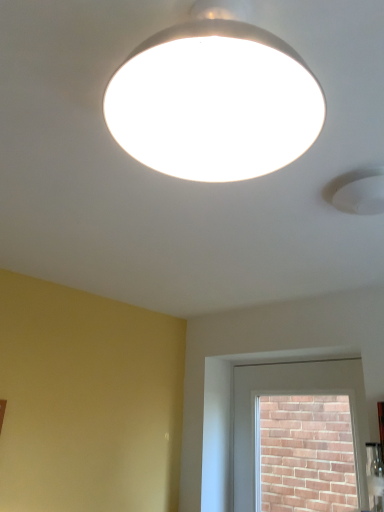
This screenshot has height=512, width=384. I want to click on brick at upper center, so (293, 394).

Image resolution: width=384 pixels, height=512 pixels. What do you see at coordinates (293, 394) in the screenshot?
I see `brick at upper center` at bounding box center [293, 394].

This screenshot has height=512, width=384. I want to click on white matte lamp at upper center, so click(x=214, y=99).

Image resolution: width=384 pixels, height=512 pixels. Describe the element at coordinates (214, 99) in the screenshot. I see `white matte lamp at upper center` at that location.

The width and height of the screenshot is (384, 512). Find the location of `brick at upper center`. brick at upper center is located at coordinates (293, 394).

Is white matte lamp at upper center to the left of brick at upper center from the viewer's perspective?

Yes.

Does white matte lamp at upper center come in front of brick at upper center?

Yes, the depth of white matte lamp at upper center is less than that of brick at upper center.

Considering the points (180, 123) and (335, 382), which point is in front, point (180, 123) or point (335, 382)?

Positioned in front is point (180, 123).

From the image's perspective, does white matte lamp at upper center appear higher than brick at upper center?

Yes, from the image's perspective, white matte lamp at upper center is above brick at upper center.

From a real-world perspective, relative to brick at upper center, is white matte lamp at upper center vertically above or below?

white matte lamp at upper center is above brick at upper center.

Is white matte lamp at upper center wider or thinner than brick at upper center?

white matte lamp at upper center is wider than brick at upper center.

Considering the sizes of objects white matte lamp at upper center and brick at upper center in the image provided, who is shorter, white matte lamp at upper center or brick at upper center?

With less height is white matte lamp at upper center.

Is white matte lamp at upper center bigger than brick at upper center?

Actually, white matte lamp at upper center might be smaller than brick at upper center.

Is white matte lamp at upper center not inside brick at upper center?

white matte lamp at upper center is positioned outside brick at upper center.

Is there a large distance between white matte lamp at upper center and brick at upper center?

Yes.

Does white matte lamp at upper center turn towards brick at upper center?

No, white matte lamp at upper center is not oriented towards brick at upper center.

How different are the orientations of white matte lamp at upper center and brick at upper center in degrees?

There is a 90-degree angle between the facing directions of white matte lamp at upper center and brick at upper center.

How far apart are white matte lamp at upper center and brick at upper center?

white matte lamp at upper center and brick at upper center are 5.71 feet apart.

In order to click on lamp on the left of the brick at upper center in this screenshot , I will do `click(214, 99)`.

Consider the image. Between brick at upper center and white matte lamp at upper center, which one appears on the left side from the viewer's perspective?

white matte lamp at upper center is more to the left.

Which object is further away from the camera taking this photo, brick at upper center or white matte lamp at upper center?

Positioned behind is brick at upper center.

Which is further, (269, 386) or (117, 117)?

The point (269, 386) is farther.

From the image's perspective, is brick at upper center beneath white matte lamp at upper center?

Correct, brick at upper center appears lower than white matte lamp at upper center in the image.

From a real-world perspective, who is located higher, brick at upper center or white matte lamp at upper center?

white matte lamp at upper center.

Can you confirm if brick at upper center is thinner than white matte lamp at upper center?

Indeed, brick at upper center has a lesser width compared to white matte lamp at upper center.

Which of these two, brick at upper center or white matte lamp at upper center, stands shorter?

white matte lamp at upper center is shorter.

Looking at this image, which of these two, brick at upper center or white matte lamp at upper center, is bigger?

With larger size is brick at upper center.

Is white matte lamp at upper center surrounded by brick at upper center?

No, brick at upper center does not contain white matte lamp at upper center.

Is brick at upper center not close to white matte lamp at upper center?

Yes.

Is brick at upper center positioned with its back to white matte lamp at upper center?

No, white matte lamp at upper center is not at the back of brick at upper center.

How different are the orientations of brick at upper center and white matte lamp at upper center in degrees?

They differ by 90 degrees in their facing directions.

Identify the location of window below the white matte lamp at upper center (from the image's perspective). Image resolution: width=384 pixels, height=512 pixels. (293, 394).

There is a brick at upper center. Where is `lamp above it (from a real-world perspective)`? This screenshot has height=512, width=384. lamp above it (from a real-world perspective) is located at coordinates (214, 99).

Where is `window that appears on the right of white matte lamp at upper center`? The image size is (384, 512). window that appears on the right of white matte lamp at upper center is located at coordinates (293, 394).